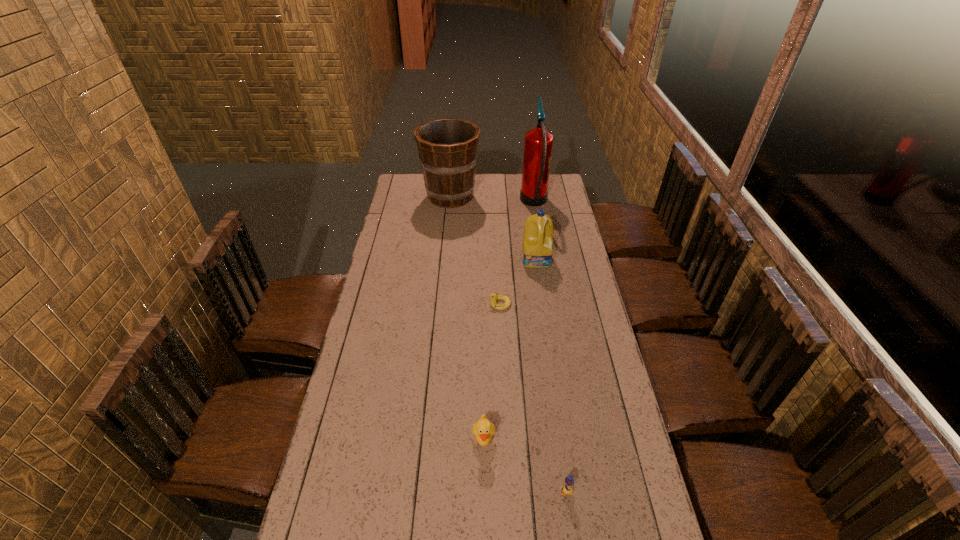
Find the location of a particular element. free space between the second tallest object and the farthest duckling is located at coordinates (475, 250).

Locate an element on the screen. vacant region between the second farthest duckling and the shortest duckling is located at coordinates (492, 372).

At what (x,y) coordinates should I click in order to perform the action: click on free space between the fifth shortest object and the second shortest object. Please return your answer as a coordinate pair (x, y). Image resolution: width=960 pixels, height=540 pixels. Looking at the image, I should click on (508, 344).

Identify the location of empty location between the rightmost duckling and the fourth nearest object. (551, 375).

Image resolution: width=960 pixels, height=540 pixels. In order to click on vacant area that lies between the fifth farthest object and the farthest duckling in this screenshot , I will do `click(492, 372)`.

Where is `free area in between the second tallest duckling and the second farthest duckling`? free area in between the second tallest duckling and the second farthest duckling is located at coordinates (525, 466).

At what (x,y) coordinates should I click in order to perform the action: click on free spot between the fire extinguisher and the bucket. Please return your answer as a coordinate pair (x, y). Looking at the image, I should click on [x=492, y=200].

This screenshot has width=960, height=540. I want to click on the fifth closest object to the nearest duckling, so click(x=447, y=147).

This screenshot has height=540, width=960. Find the location of `the third closest object to the third tallest object`. the third closest object to the third tallest object is located at coordinates (447, 147).

Identify which duckling is the closest to the nearest duckling. Please provide its 2D coordinates. Your answer should be formatted as a tuple, i.e. [(x, y)], where the tuple contains the x and y coordinates of a point satisfying the conditions above.

[(483, 430)]